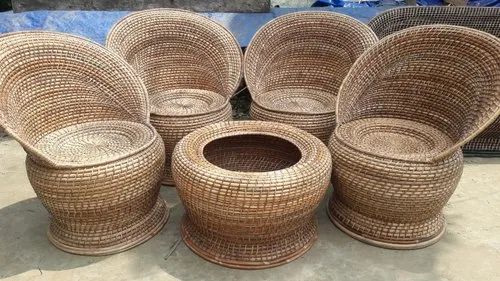
Where is `the second from right chair seat`? Image resolution: width=500 pixels, height=281 pixels. the second from right chair seat is located at coordinates (304, 100).